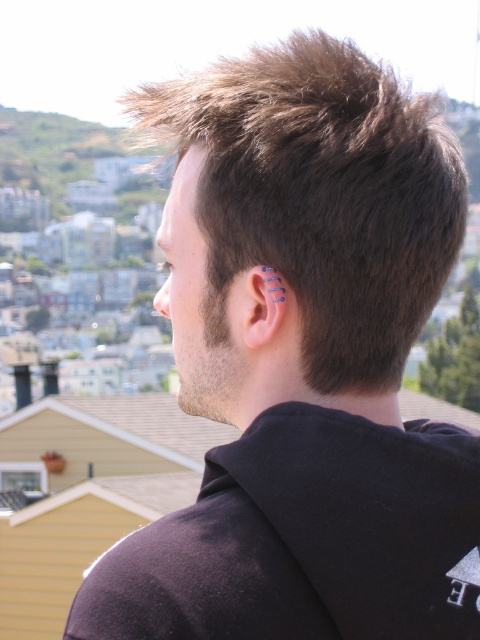
What is the exact coordinate of the dark brown hair at upper center?

The dark brown hair at upper center is located at point (320, 196).

You are a photographer standing at the camera position. You want to take a closeup shot of the dark brown hair at upper center. Given that the camera can only focus on objects within 50 meters, will you be able to capture a clear photo?

→ The dark brown hair at upper center is 69.44 meters away from camera, which is beyond the camera focus range of 50 meters. Therefore, you cannot capture a clear photo.